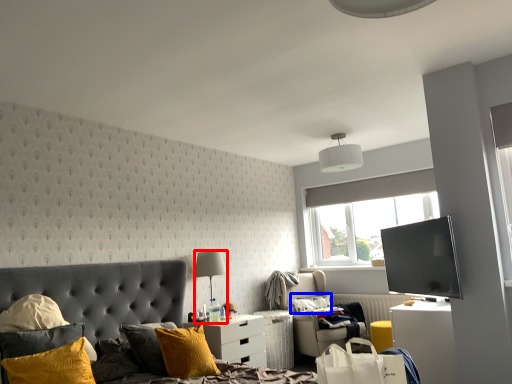
Question: Which object is further to the camera taking this photo, lamp (highlighted by a red box) or pillow (highlighted by a blue box)?

Choices:
 (A) lamp
 (B) pillow

Answer: (B)